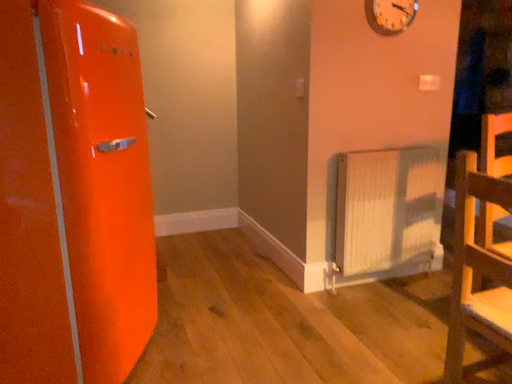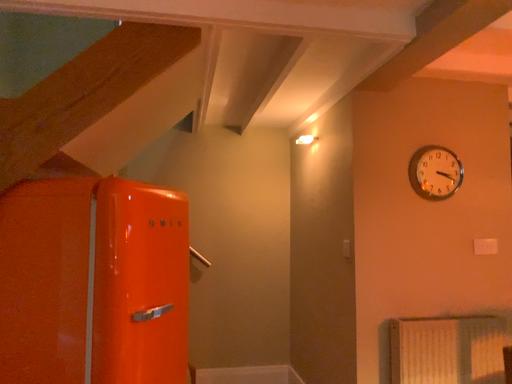
Question: Which way did the camera rotate in the video?

Choices:
 (A) rotated right
 (B) rotated left

Answer: (B)